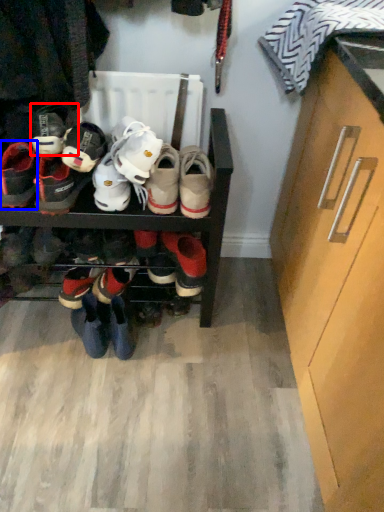
Question: Which point is further to the camera, footwear (highlighted by a red box) or footwear (highlighted by a blue box)?

Choices:
 (A) footwear
 (B) footwear

Answer: (B)